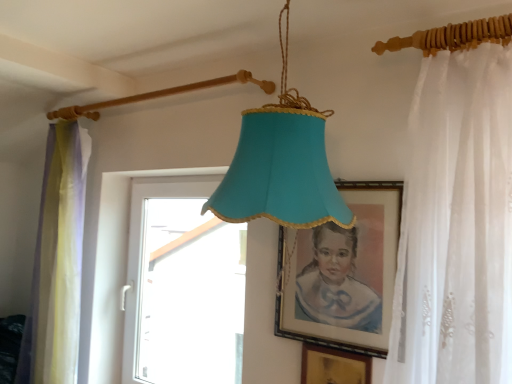
Question: Is point (350, 311) closer or farther from the camera than point (164, 235)?

Choices:
 (A) farther
 (B) closer

Answer: (B)

Question: From the image's perspective, is matte gold picture frame at center, the 1th picture frame when ordered from top to bottom, positioned above or below white plastic window at center?

Choices:
 (A) below
 (B) above

Answer: (B)

Question: Considering the real-world distances, which object is closest to the white sheer curtain at right, the first curtain viewed from the right?

Choices:
 (A) translucent yellowish-green curtain at left, the 1th curtain in the left-to-right sequence
 (B) matte gold picture frame at center, the 1th picture frame when ordered from top to bottom
 (C) gold metallic picture frame at lower center, marked as the 2th picture frame in a top-to-bottom arrangement
 (D) white plastic window at center

Answer: (B)

Question: Estimate the real-world distances between objects in this image. Which object is farther from the white sheer curtain at right, which appears as the 1th curtain when viewed from the front?

Choices:
 (A) matte gold picture frame at center, which ranks as the second picture frame in bottom-to-top order
 (B) translucent yellowish-green curtain at left, arranged as the second curtain when viewed from the front
 (C) gold metallic picture frame at lower center, marked as the 2th picture frame in a top-to-bottom arrangement
 (D) white plastic window at center

Answer: (B)